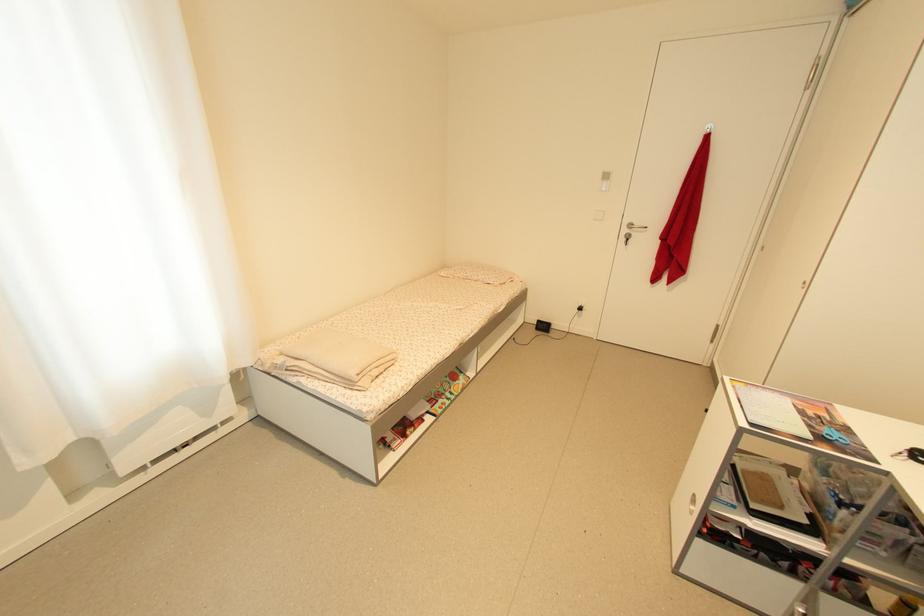
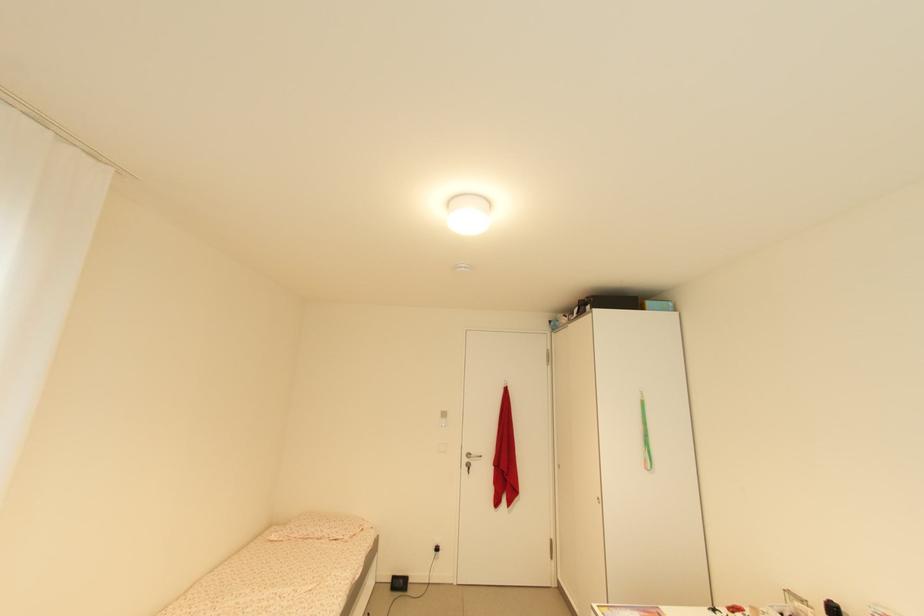
The images are taken continuously from a first-person perspective. In which direction is your viewpoint rotating?

The camera rotated toward right-up.